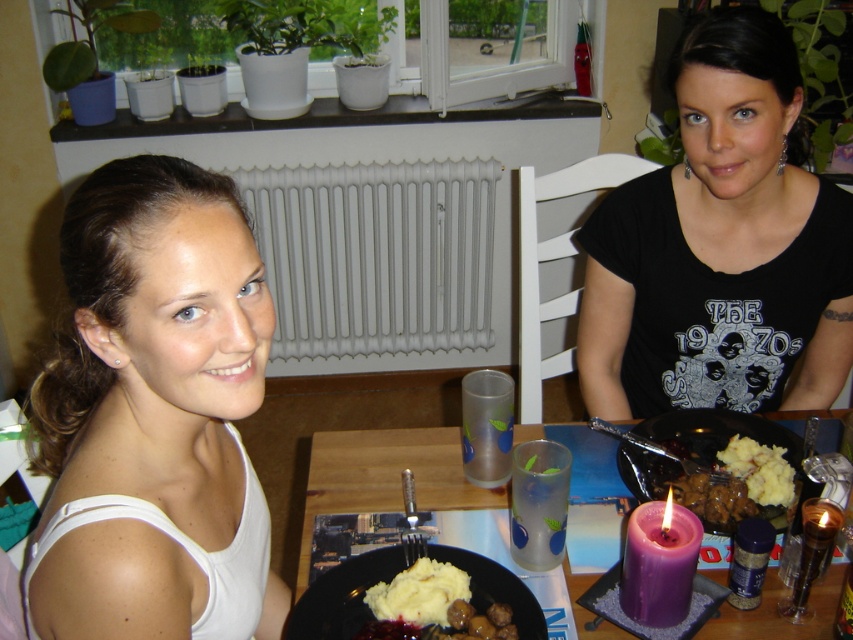
Question: Which of the following is the closest to the observer?

Choices:
 (A) (511, 618)
 (B) (235, 458)
 (C) (374, 348)

Answer: (B)

Question: Based on their relative distances, which object is nearer to the matte brown meat at right?

Choices:
 (A) smooth creamy mashed potatoes at center
 (B) white creamy mashed potatoes at center
 (C) black matte shirt at center
 (D) matte black plate with mashed potatoes and meatballs at center

Answer: (A)

Question: Does white metallic radiator at center appear on the right side of matte brown meat at right?

Choices:
 (A) yes
 (B) no

Answer: (B)

Question: Does white matte tank top at upper left have a lesser width compared to white creamy mashed potatoes at center?

Choices:
 (A) no
 (B) yes

Answer: (A)

Question: Observing the image, what is the correct spatial positioning of white matte tank top at upper left in reference to black matte shirt at center?

Choices:
 (A) above
 (B) below

Answer: (B)

Question: Estimate the real-world distances between objects in this image. Which object is closer to the black matte shirt at center?

Choices:
 (A) white matte tank top at upper left
 (B) smooth creamy mashed potatoes at center
 (C) matte black plate with mashed potatoes and meatballs at center
 (D) white metallic radiator at center

Answer: (B)